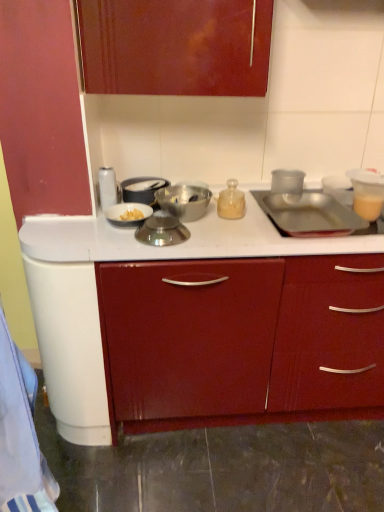
Locate an element on the screen. The image size is (384, 512). free space in front of translucent glass jar at center, the second kitchen appliance positioned from the right is located at coordinates (241, 237).